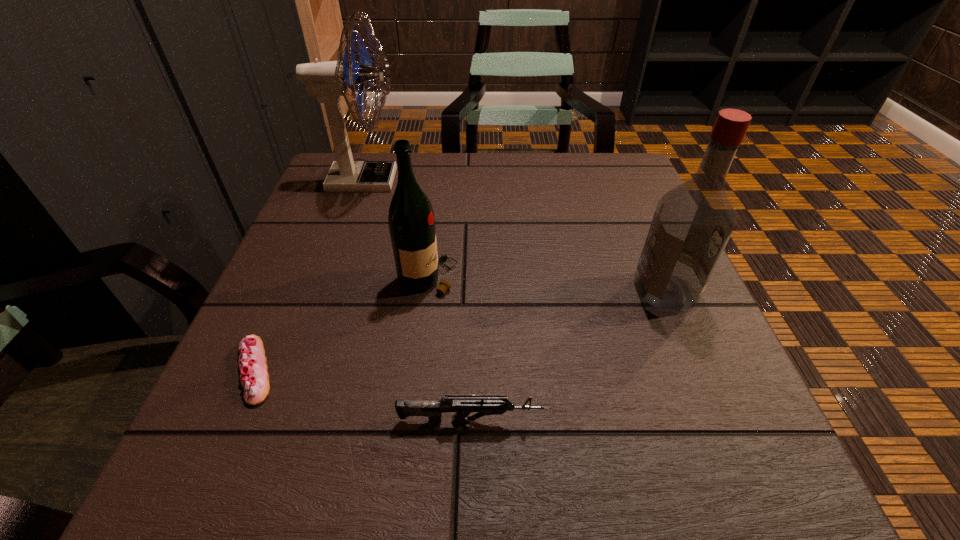
The height and width of the screenshot is (540, 960). Find the location of `the farthest object`. the farthest object is located at coordinates (328, 80).

The width and height of the screenshot is (960, 540). I want to click on liquor, so click(693, 222).

Identify the location of the third shortest object. This screenshot has height=540, width=960. (411, 221).

The height and width of the screenshot is (540, 960). I want to click on the nearest object, so click(x=464, y=404).

At what (x,y) coordinates should I click in order to perform the action: click on gun. Please return your answer as a coordinate pair (x, y). The height and width of the screenshot is (540, 960). Looking at the image, I should click on (464, 404).

At what (x,y) coordinates should I click in order to perform the action: click on the second nearest object. Please return your answer as a coordinate pair (x, y). The height and width of the screenshot is (540, 960). Looking at the image, I should click on (252, 363).

Locate an element on the screen. The height and width of the screenshot is (540, 960). eclair is located at coordinates (252, 363).

Identify the location of vacant area situated on the front-facing side of the fan. The height and width of the screenshot is (540, 960). (462, 180).

Where is `free space located 0.320m on the front-facing side of the rightmost object`? free space located 0.320m on the front-facing side of the rightmost object is located at coordinates (464, 292).

Where is `free space located 0.170m on the front-facing side of the rightmost object`? This screenshot has width=960, height=540. free space located 0.170m on the front-facing side of the rightmost object is located at coordinates (545, 292).